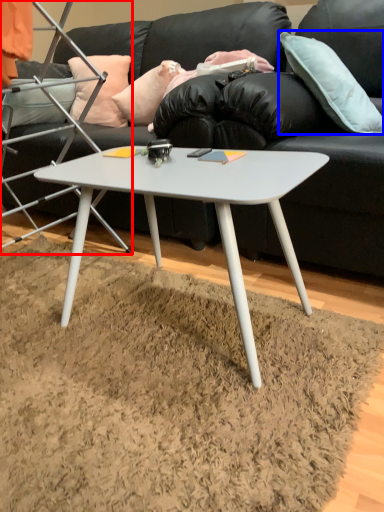
Question: Which object is further to the camera taking this photo, chair (highlighted by a red box) or pillow (highlighted by a blue box)?

Choices:
 (A) chair
 (B) pillow

Answer: (B)